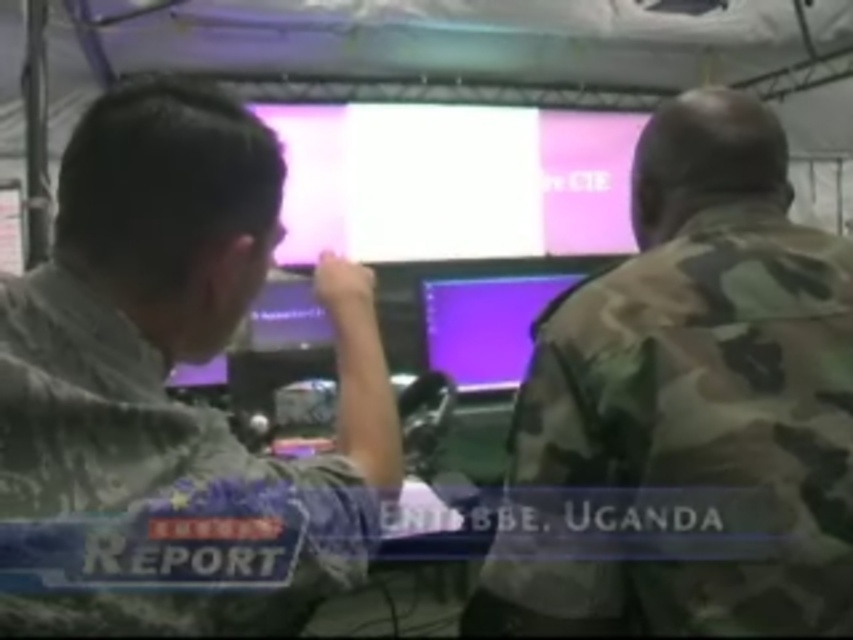
Is camouflage uniform at center closer to camera compared to camo uniform at center?

Yes, camouflage uniform at center is in front of camo uniform at center.

Which is more to the left, camouflage uniform at center or camo uniform at center?

camouflage uniform at center

You are a GUI agent. You are given a task and a screenshot of the screen. Output one action in this format:
    pyautogui.click(x=<x>, y=<y>)
    Task: Click on the camouflage uniform at center
    This screenshot has height=640, width=853.
    Given the screenshot: What is the action you would take?
    pyautogui.click(x=166, y=396)

Between camouflage uniform at center and purple glossy monitor at center, which one is positioned higher?

camouflage uniform at center

Does camouflage uniform at center have a smaller size compared to purple glossy monitor at center?

No, camouflage uniform at center is not smaller than purple glossy monitor at center.

Locate an element on the screen. The height and width of the screenshot is (640, 853). camouflage uniform at center is located at coordinates (166, 396).

Is camouflage uniform at center bigger than pink glossy monitor at center?

No.

How distant is camouflage uniform at center from pink glossy monitor at center?

The distance of camouflage uniform at center from pink glossy monitor at center is 11.26 feet.

Who is more forward, [380,420] or [498,148]?

Point [380,420] is more forward.

I want to click on camouflage uniform at center, so click(166, 396).